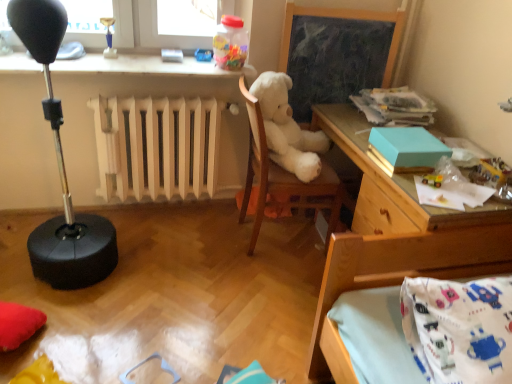
You are a GUI agent. You are given a task and a screenshot of the screen. Output one action in this format:
    pyautogui.click(x=<x>, y=<y>)
    Task: Click on the blank area to the left of metallic yellow toy car at upper right, the first toy when ordered from bottom to top
    
    Given the screenshot: What is the action you would take?
    pyautogui.click(x=408, y=180)